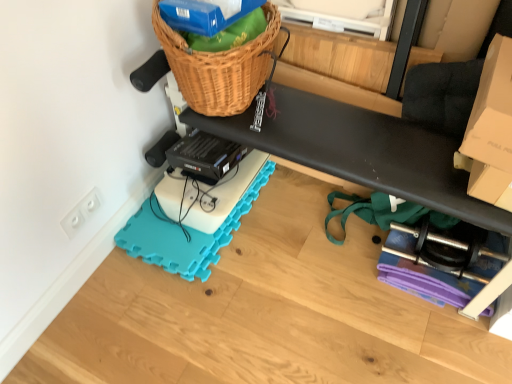
Question: Is white plastic electrical outlet at lower left facing away from cardboard box at upper right?

Choices:
 (A) no
 (B) yes

Answer: (A)

Question: Is white plastic electrical outlet at lower left positioned in front of cardboard box at upper right?

Choices:
 (A) yes
 (B) no

Answer: (B)

Question: Can you confirm if white plastic electrical outlet at lower left is shorter than cardboard box at upper right?

Choices:
 (A) yes
 (B) no

Answer: (A)

Question: From the image's perspective, is white plastic electrical outlet at lower left below cardboard box at upper right?

Choices:
 (A) yes
 (B) no

Answer: (A)

Question: Can you see white plastic electrical outlet at lower left touching cardboard box at upper right?

Choices:
 (A) yes
 (B) no

Answer: (B)

Question: From the image's perspective, is woven brown basket at upper center positioned above or below white plastic electrical outlet at lower left?

Choices:
 (A) above
 (B) below

Answer: (A)

Question: Looking at the image, does woven brown basket at upper center seem bigger or smaller compared to white plastic electrical outlet at lower left?

Choices:
 (A) big
 (B) small

Answer: (A)

Question: Is point [176, 46] closer or farther from the camera than point [72, 231]?

Choices:
 (A) closer
 (B) farther

Answer: (A)

Question: Considering the positions of woven brown basket at upper center and white plastic electrical outlet at lower left in the image, is woven brown basket at upper center wider or thinner than white plastic electrical outlet at lower left?

Choices:
 (A) wide
 (B) thin

Answer: (A)

Question: From a real-world perspective, is black rubber exercise mat at lower center positioned above or below white plastic electrical outlet at lower left?

Choices:
 (A) below
 (B) above

Answer: (A)

Question: Considering their positions, is black rubber exercise mat at lower center located in front of or behind white plastic electrical outlet at lower left?

Choices:
 (A) behind
 (B) front

Answer: (B)

Question: Is point (406, 107) positioned closer to the camera than point (77, 223)?

Choices:
 (A) farther
 (B) closer

Answer: (B)

Question: In terms of height, does black rubber exercise mat at lower center look taller or shorter compared to white plastic electrical outlet at lower left?

Choices:
 (A) short
 (B) tall

Answer: (A)

Question: In the image, is black rubber exercise mat at lower center positioned in front of or behind cardboard box at upper right?

Choices:
 (A) behind
 (B) front

Answer: (B)

Question: Is black rubber exercise mat at lower center to the left or to the right of cardboard box at upper right in the image?

Choices:
 (A) left
 (B) right

Answer: (A)